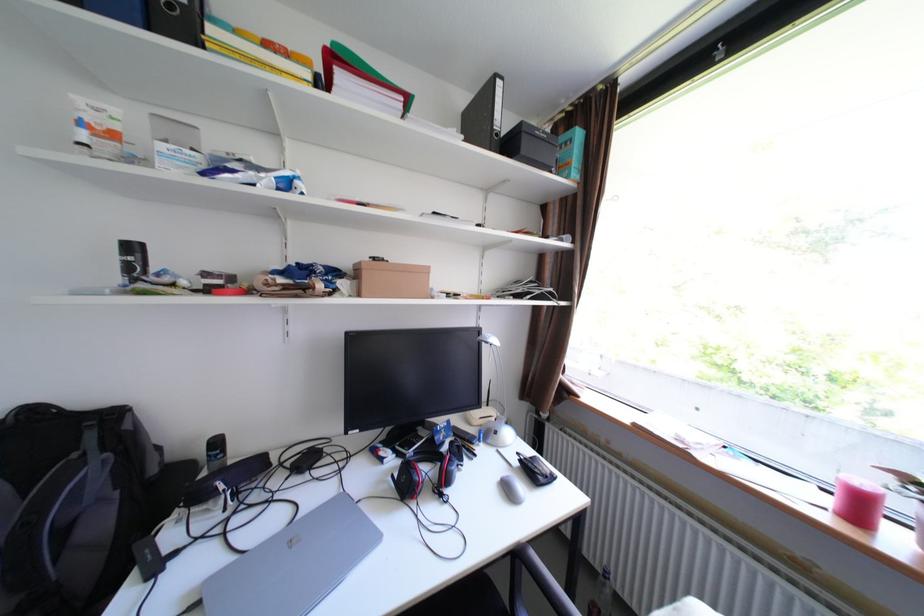
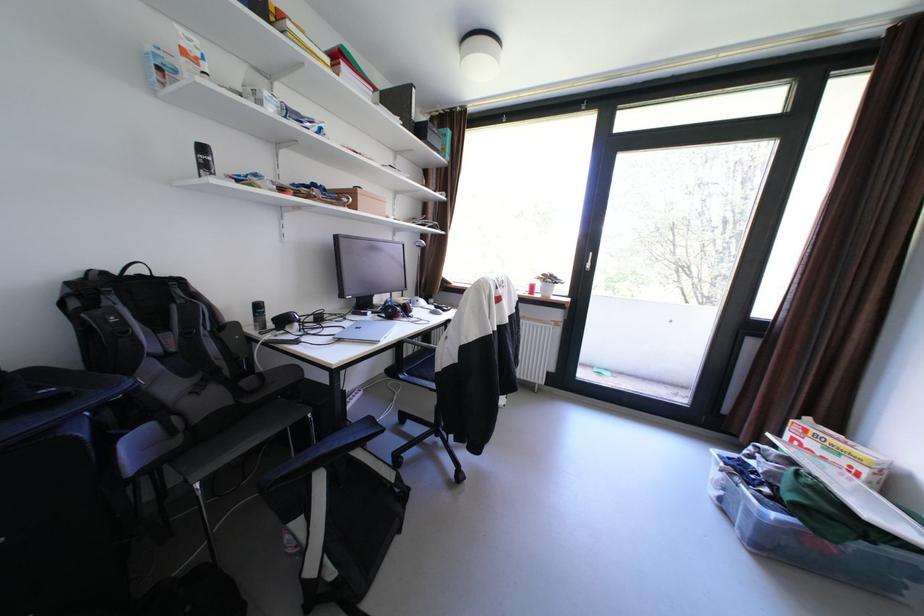
Find the pixel in the second image that matches (375,275) in the first image.

(370, 197)